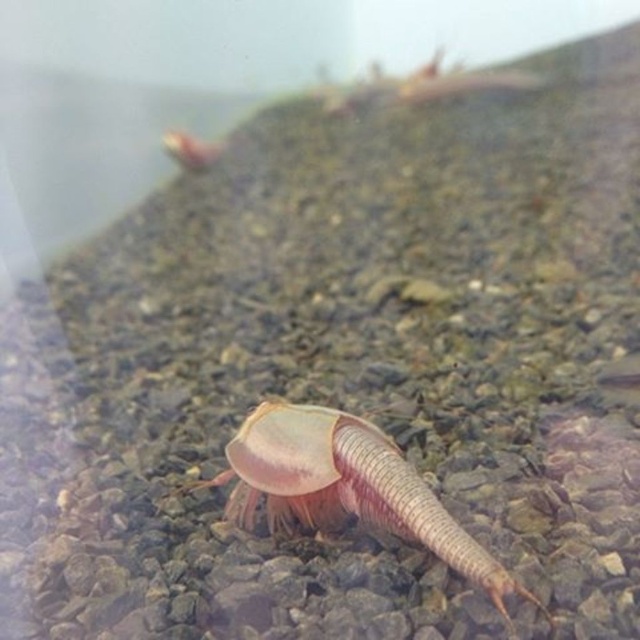
Consider the image. Is translucent pink exoskeleton at center below translucent pink shrimp at upper left?

Correct, translucent pink exoskeleton at center is located below translucent pink shrimp at upper left.

Is translucent pink exoskeleton at center shorter than translucent pink shrimp at upper left?

Incorrect, translucent pink exoskeleton at center's height does not fall short of translucent pink shrimp at upper left's.

Where is `translucent pink exoskeleton at center`? This screenshot has height=640, width=640. translucent pink exoskeleton at center is located at coordinates (346, 486).

Where is `translucent pink exoskeleton at center`? The height and width of the screenshot is (640, 640). translucent pink exoskeleton at center is located at coordinates (346, 486).